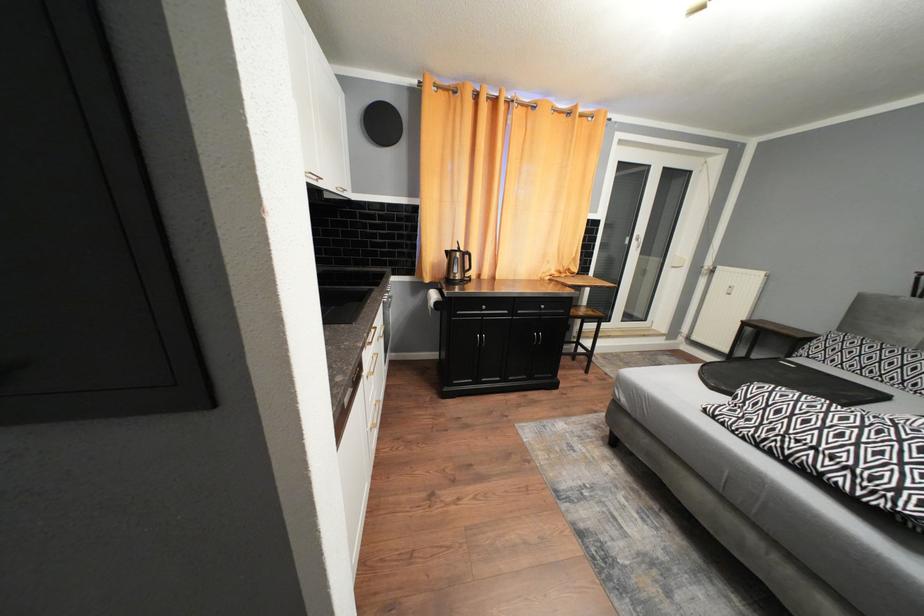
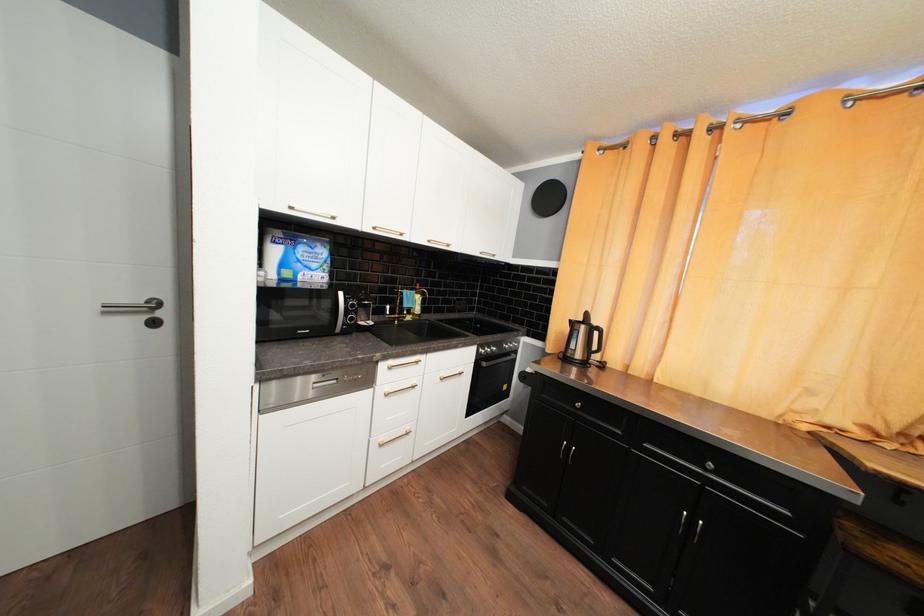
Question: The images are taken continuously from a first-person perspective. In which direction is your viewpoint rotating?

Choices:
 (A) Left
 (B) Right
 (C) Up
 (D) Down

Answer: (A)